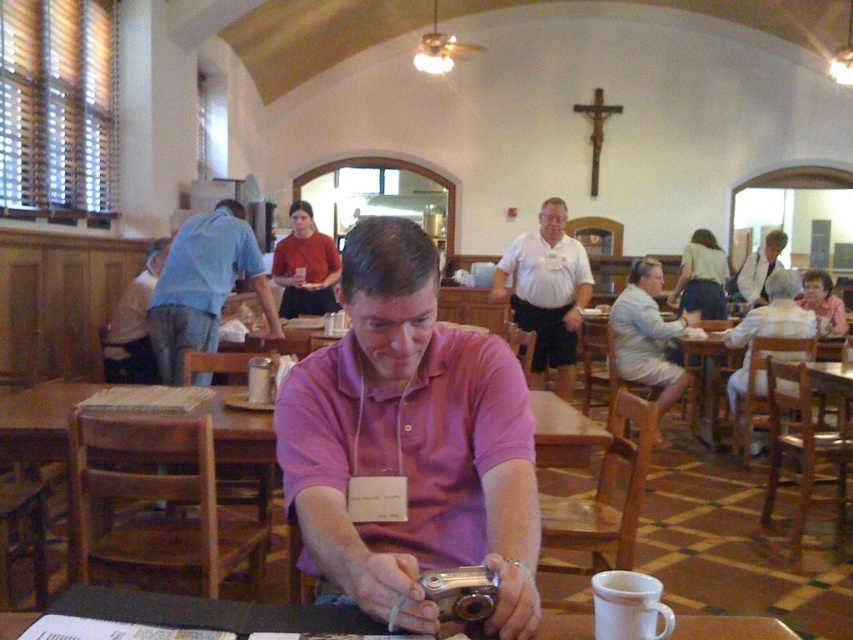
You are a photographer standing in the communal dining area and want to take a picture of the wooden table at center and the light blue shorts at right. Based on their positions, which object is located to the left of the other?

The wooden table at center is positioned on the left side of light blue shorts at right.

You are a guest at this dining area and want to sit down. The wooden table at center and the light blue shorts at right are both in your path. Which object is lower to the ground and easier to step over?

The wooden table at center is shorter than light blue shorts at right, so it is lower to the ground and easier to step over.